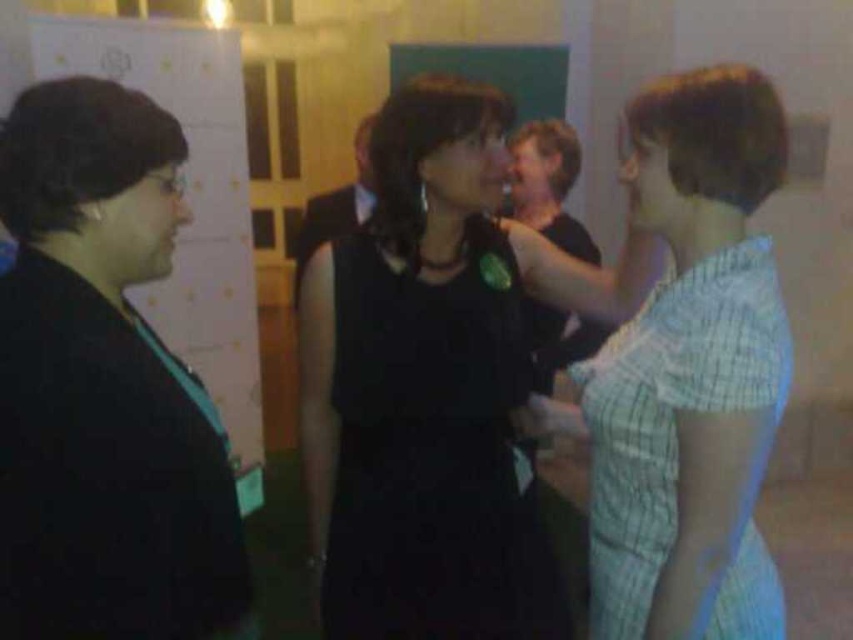
Describe the element at coordinates (433, 456) in the screenshot. I see `black matte dress at center` at that location.

Who is higher up, black matte dress at center or light blue checkered dress at right?

light blue checkered dress at right is higher up.

This screenshot has height=640, width=853. I want to click on black matte dress at center, so click(x=433, y=456).

Is black matte jacket at left above light blue checkered dress at right?

Yes.

You are a GUI agent. You are given a task and a screenshot of the screen. Output one action in this format:
    pyautogui.click(x=<x>, y=<y>)
    Task: Click on the black matte jacket at left
    
    Given the screenshot: What is the action you would take?
    pyautogui.click(x=103, y=387)

Is point (126, 205) positioned after point (492, 353)?

No.

Between point (181, 616) and point (396, 433), which one is positioned in front?

Point (181, 616) is more forward.

Between point (85, 394) and point (537, 512), which one is positioned behind?

The point (537, 512) is behind.

Locate an element on the screen. black matte jacket at left is located at coordinates (103, 387).